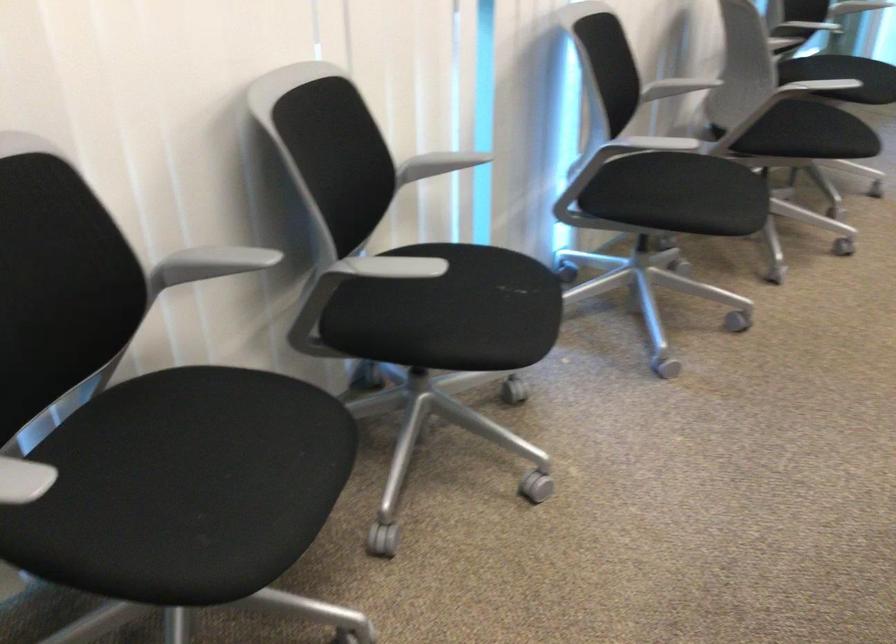
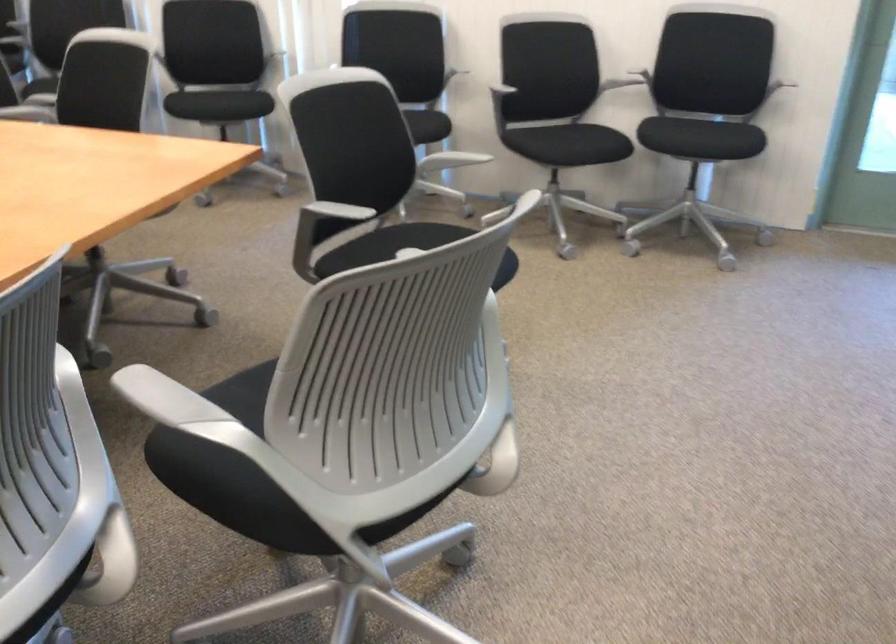
Question: I am providing you with two images of the same scene from different viewpoints. After the viewpoint changes to image2, which objects are now occluded?

Choices:
 (A) gray chair armrest
 (B) black chair sitting surface
 (C) black door knob
 (D) gray adjustment knob

Answer: (B)